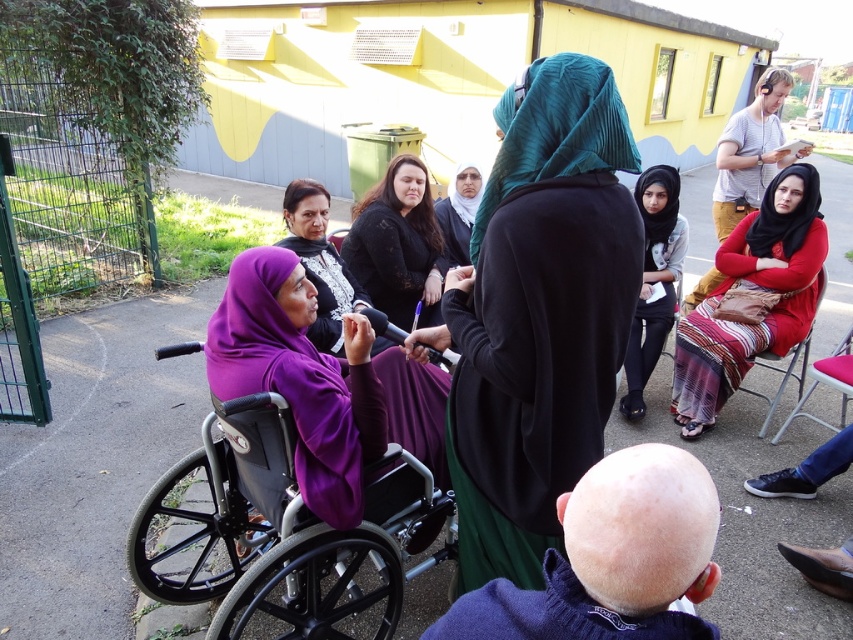
Does point (281, 250) come in front of point (323, 321)?

Yes, point (281, 250) is in front of point (323, 321).

Image resolution: width=853 pixels, height=640 pixels. I want to click on purple matte hijab at center, so click(x=322, y=384).

Locate an element on the screen. purple matte hijab at center is located at coordinates (322, 384).

Which is in front, point (775, 198) or point (326, 260)?

Positioned in front is point (326, 260).

Is red matte dress at center closer to camera compared to purple satin hijab at center?

No.

Who is more forward, (x=788, y=236) or (x=288, y=202)?

Positioned in front is point (x=288, y=202).

You are a GUI agent. You are given a task and a screenshot of the screen. Output one action in this format:
    pyautogui.click(x=<x>, y=<y>)
    Task: Click on the red matte dress at center
    
    Given the screenshot: What is the action you would take?
    pyautogui.click(x=750, y=291)

Does point (321, 320) come closer to viewer compared to point (817, 376)?

Yes, it is in front of point (817, 376).

What do you see at coordinates (320, 262) in the screenshot? Image resolution: width=853 pixels, height=640 pixels. I see `purple satin hijab at center` at bounding box center [320, 262].

The height and width of the screenshot is (640, 853). What do you see at coordinates (320, 262) in the screenshot?
I see `purple satin hijab at center` at bounding box center [320, 262].

Image resolution: width=853 pixels, height=640 pixels. I want to click on purple satin hijab at center, so click(x=320, y=262).